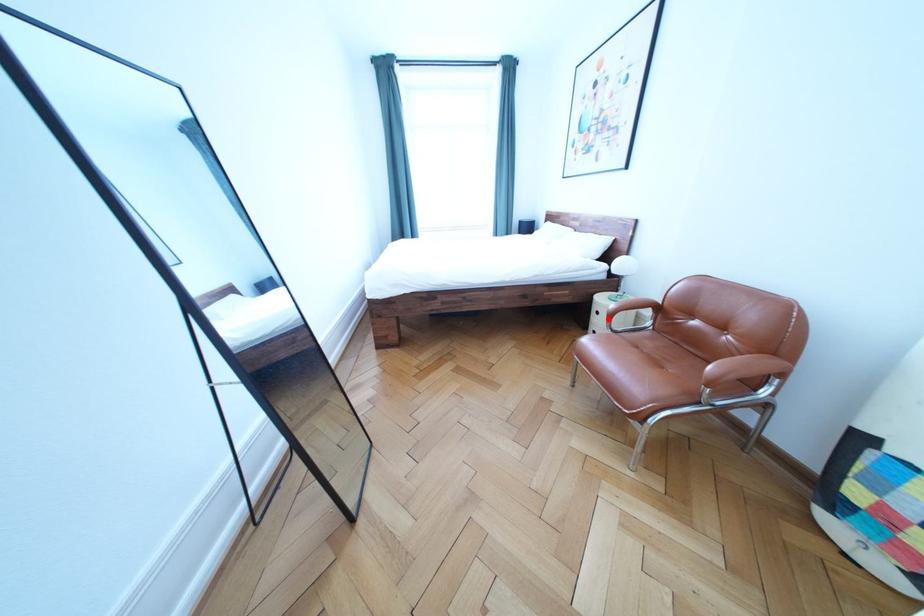
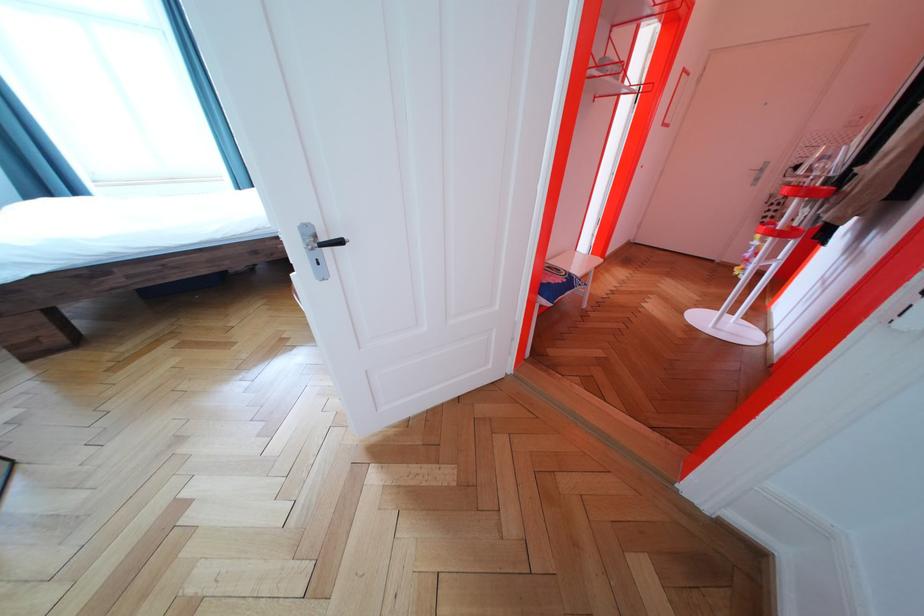
Question: I am providing you with two images of the same scene from different viewpoints. A red point is marked on the first image. At the location where the point appears in image 1, is it still visible in image 2?

Choices:
 (A) Yes
 (B) No

Answer: (B)